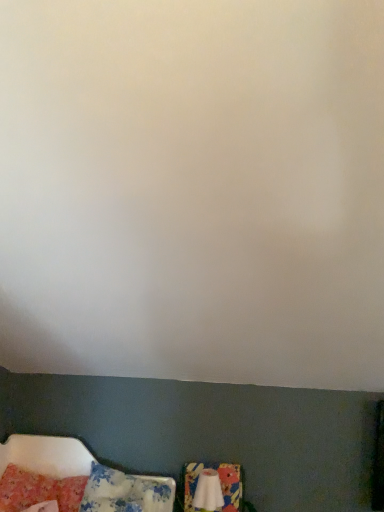
Question: From the image's perspective, is white fabric swivel chair at lower center located above or below fluffy pink pillow at lower left, positioned as the second pillow in right-to-left order?

Choices:
 (A) above
 (B) below

Answer: (B)

Question: Is point (240, 504) closer or farther from the camera than point (51, 480)?

Choices:
 (A) farther
 (B) closer

Answer: (A)

Question: Estimate the real-world distances between objects in this image. Which object is closer to the fluffy pink pillow at lower left, marked as the first pillow in a left-to-right arrangement?

Choices:
 (A) fluffy cotton pillow at lower left, which is the second pillow from left to right
 (B) white fabric swivel chair at lower center

Answer: (A)

Question: Based on their relative distances, which object is nearer to the fluffy cotton pillow at lower left, which is the second pillow from left to right?

Choices:
 (A) white fabric swivel chair at lower center
 (B) fluffy pink pillow at lower left, marked as the first pillow in a left-to-right arrangement

Answer: (B)